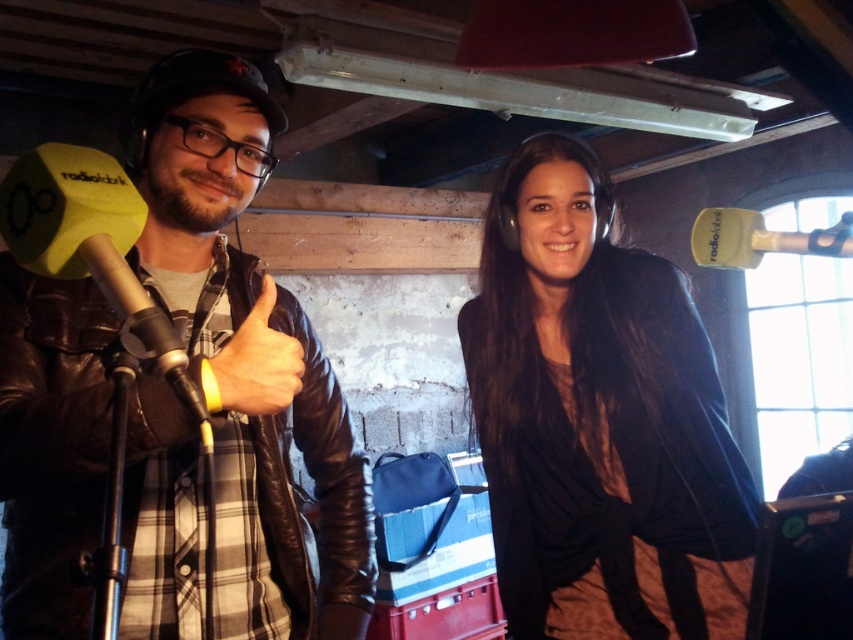
Question: Which point appears farthest from the camera in this image?

Choices:
 (A) (172, 387)
 (B) (726, 541)

Answer: (B)

Question: Which of the following is the closest to the observer?

Choices:
 (A) leather at left
 (B) leather jacket at left

Answer: (B)

Question: Can you confirm if leather at left is bigger than matte black microphone at left?

Choices:
 (A) yes
 (B) no

Answer: (A)

Question: Based on their relative distances, which object is nearer to the leather at left?

Choices:
 (A) matte black microphone at left
 (B) matte black jacket at center
 (C) leather jacket at left

Answer: (A)

Question: Can you confirm if leather jacket at left is positioned to the right of leather at left?

Choices:
 (A) yes
 (B) no

Answer: (B)

Question: Is leather at left to the left of matte black microphone at left from the viewer's perspective?

Choices:
 (A) no
 (B) yes

Answer: (A)